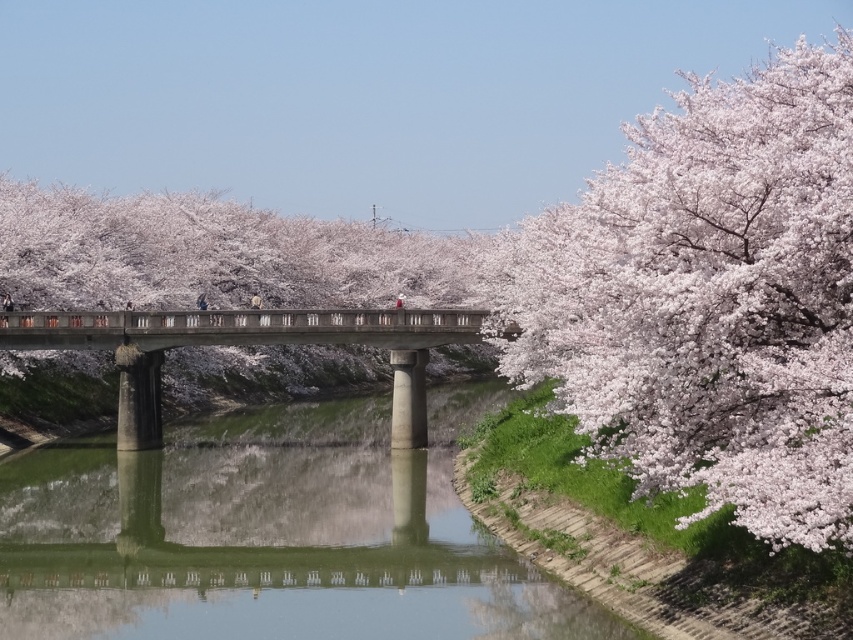
Question: Is green concrete river at center thinner than concrete bridge at center?

Choices:
 (A) yes
 (B) no

Answer: (A)

Question: Which object appears closest to the camera in this image?

Choices:
 (A) concrete bridge at center
 (B) green concrete river at center
 (C) pink blossoms at right

Answer: (C)

Question: Is pink blossoms at right below green concrete river at center?

Choices:
 (A) yes
 (B) no

Answer: (B)

Question: Where is pink blossoms at right located in relation to concrete bridge at center in the image?

Choices:
 (A) left
 (B) right

Answer: (B)

Question: Which point is farther to the camera?

Choices:
 (A) (132, 321)
 (B) (30, 609)

Answer: (A)

Question: Estimate the real-world distances between objects in this image. Which object is farther from the concrete bridge at center?

Choices:
 (A) pink blossoms at right
 (B) green concrete river at center

Answer: (A)